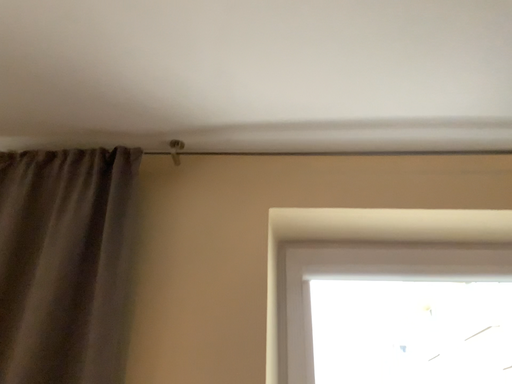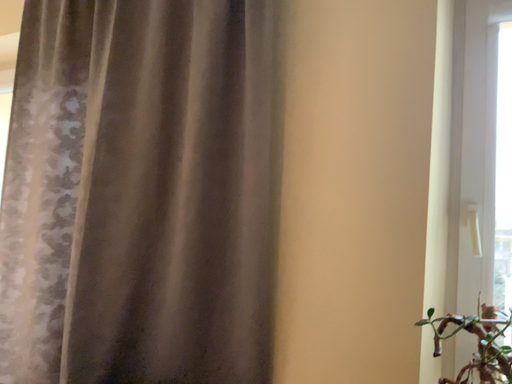
Question: How did the camera likely rotate when shooting the video?

Choices:
 (A) rotated upward
 (B) rotated downward

Answer: (B)